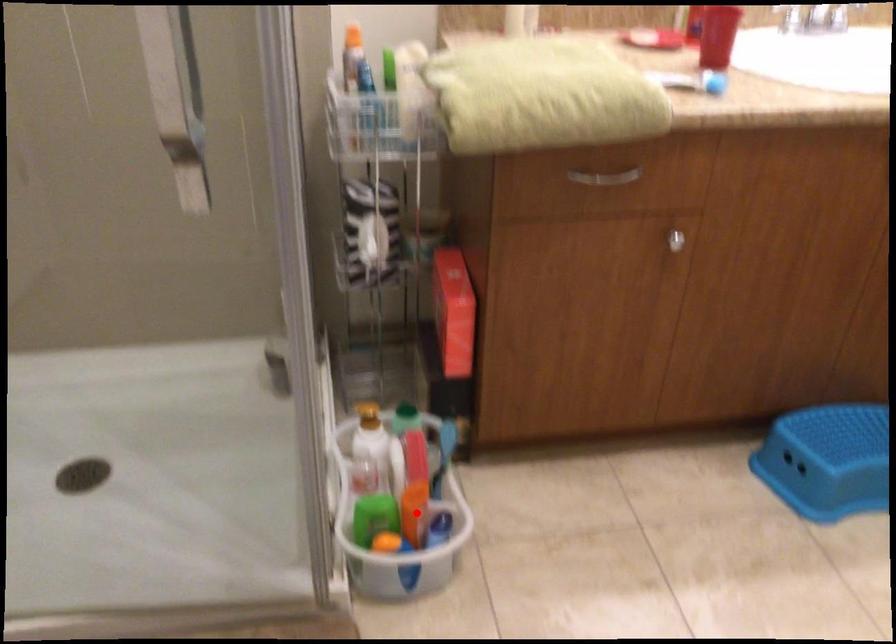
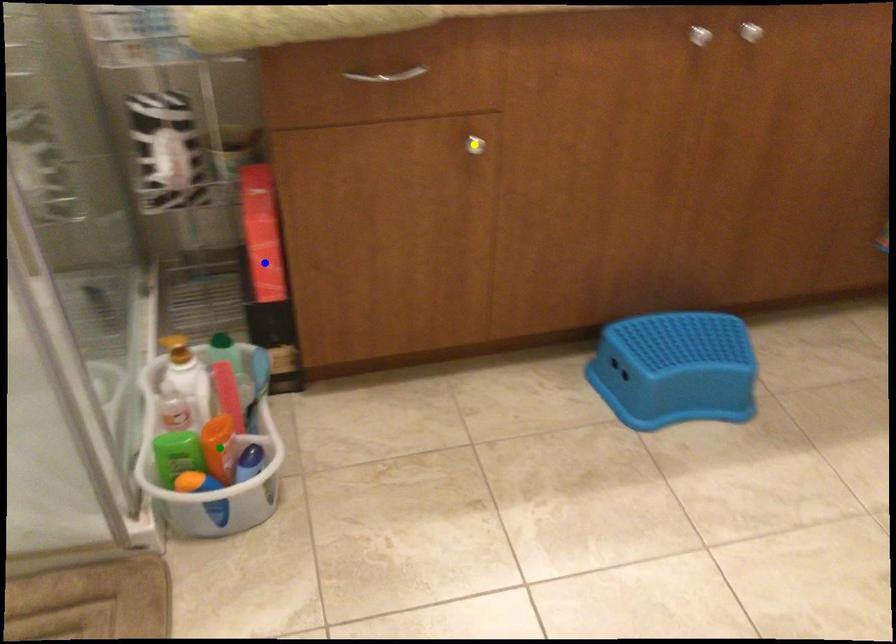
Question: I am providing you with two images of the same scene from different viewpoints. A red point is marked on the first image. You are given multiple points on the second image. Which point in image 2 is actually the same real-world point as the red point in image 1?

Choices:
 (A) green point
 (B) blue point
 (C) yellow point

Answer: (A)